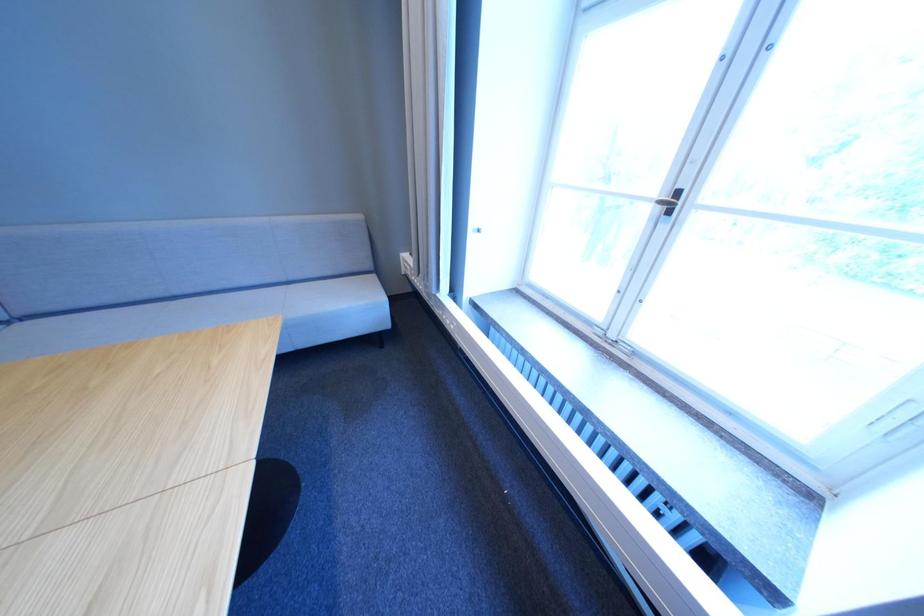
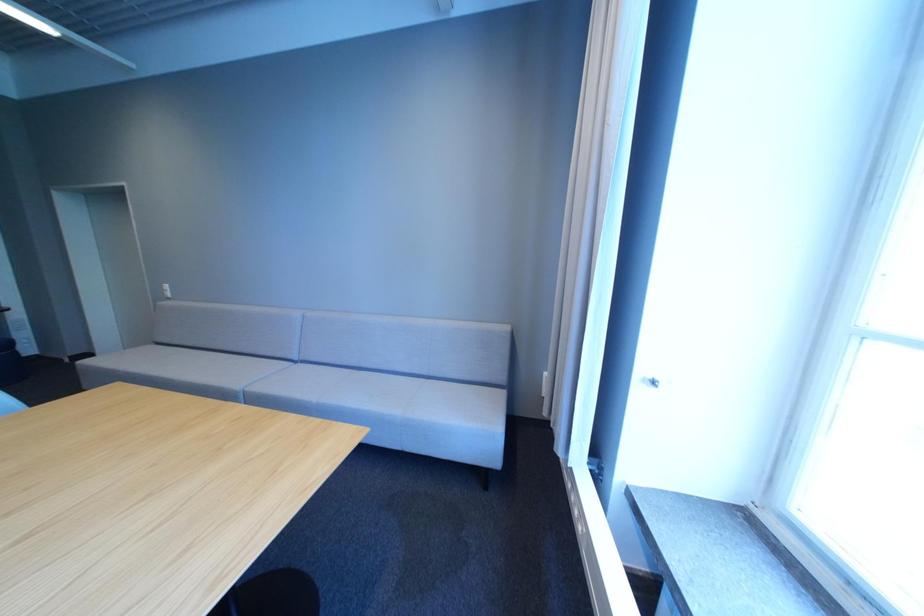
First-person continuous shooting, in which direction is the camera rotating?

The rotation direction of the camera is left-up.